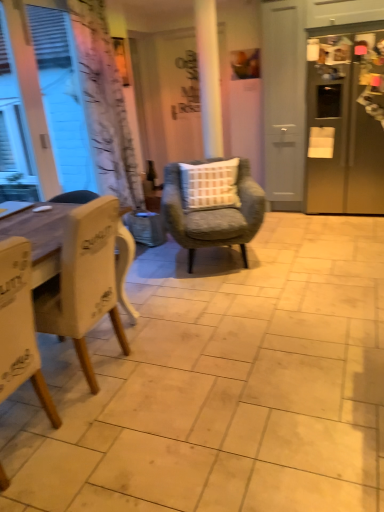
Where is `vacant area that lies to the right of white wood chair at left, the first chair from the front`? vacant area that lies to the right of white wood chair at left, the first chair from the front is located at coordinates (109, 442).